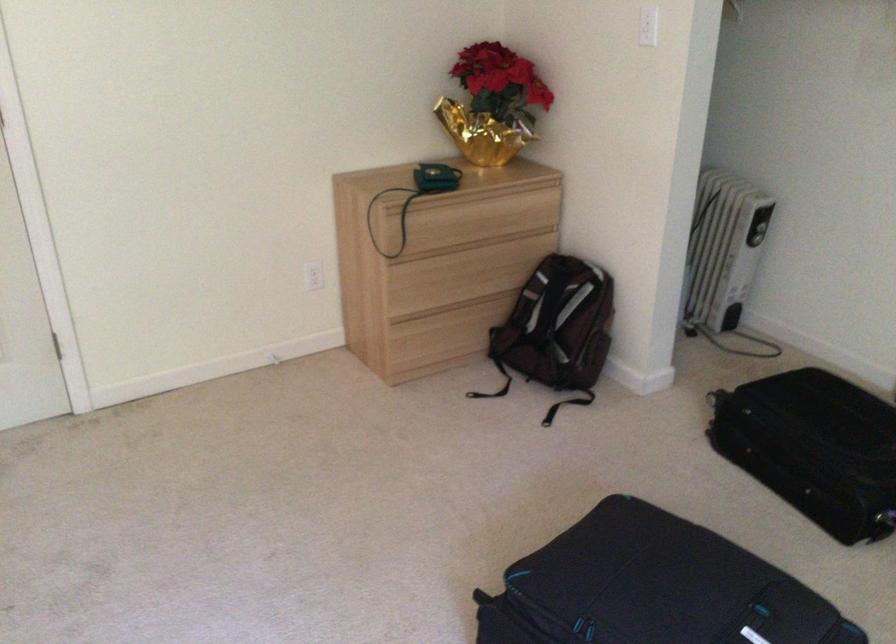
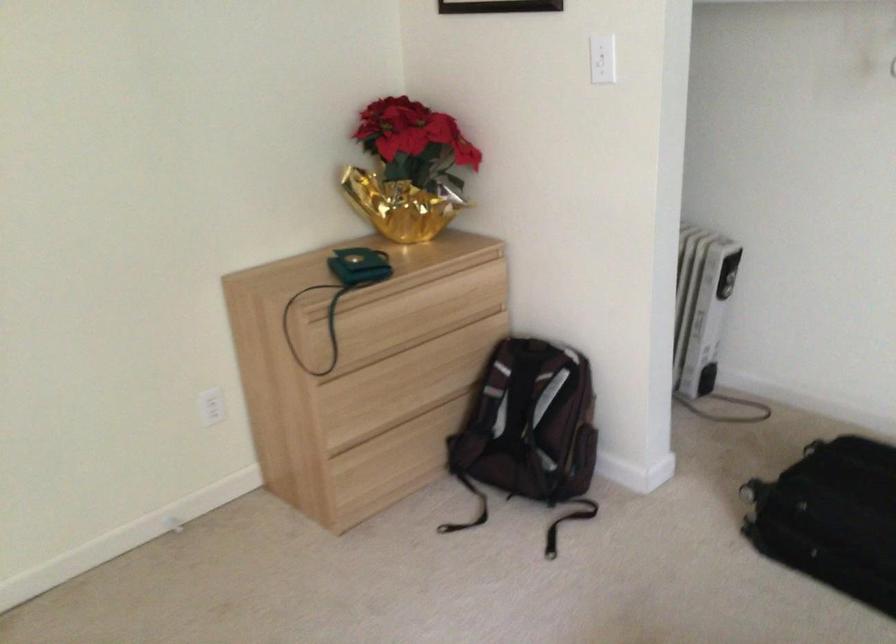
Locate, in the second image, the point that corresponds to point (431, 178) in the first image.

(358, 267)